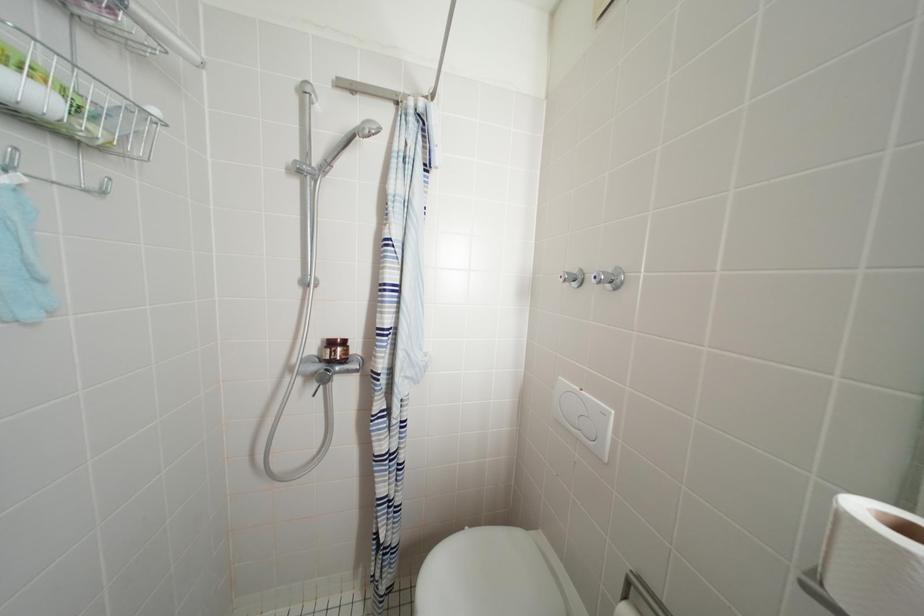
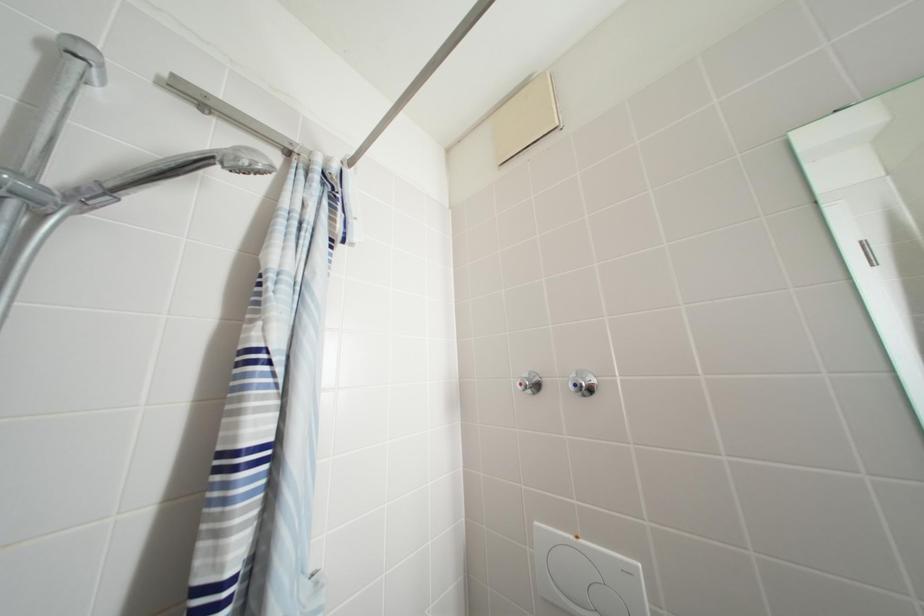
Consider the image. Based on the continuous images, in which direction is the camera rotating?

The camera rotated toward right-up.